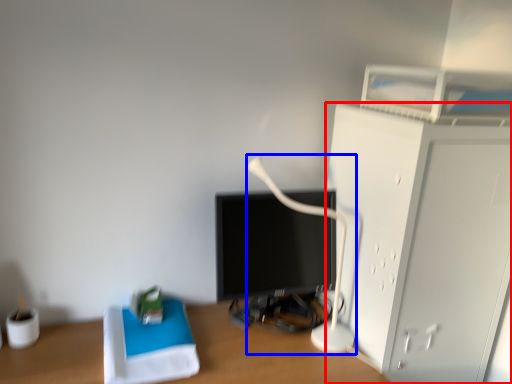
Question: Which object is closer to the camera taking this photo, furniture (highlighted by a red box) or table lamp (highlighted by a blue box)?

Choices:
 (A) furniture
 (B) table lamp

Answer: (A)